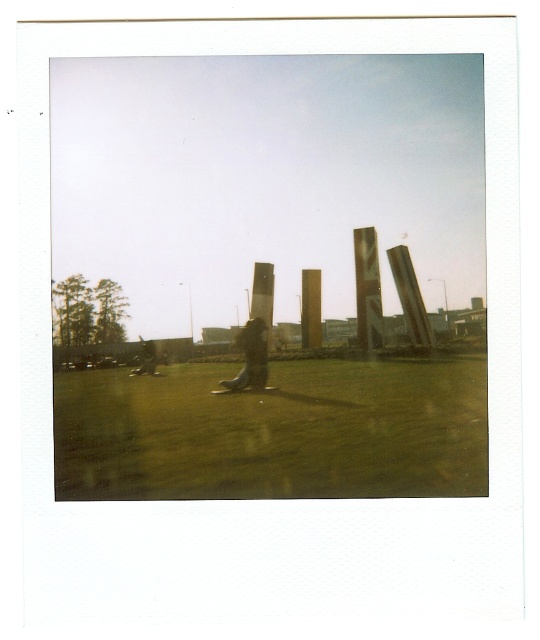
You are planning to place a small picnic basket on the green grass at center. Considering the space available, will the basket fit comfortably without overlapping the matte black jacket at lower left?

The green grass at center is wider than the matte black jacket at lower left, so placing the picnic basket there should be possible without overlapping the jacket.

You are standing in a park and see the green grass at center and the gold polished pillar at center. Which object is located to the left when viewed from your perspective?

The green grass at center is positioned on the left side of the gold polished pillar at center, so when viewed from your perspective, the green grass at center is to the left of the gold polished pillar at center.

You are standing in a park and see the green grass at center and the gold polished pillar at center. Which object is shorter?

The green grass at center is shorter than the gold polished pillar at center.